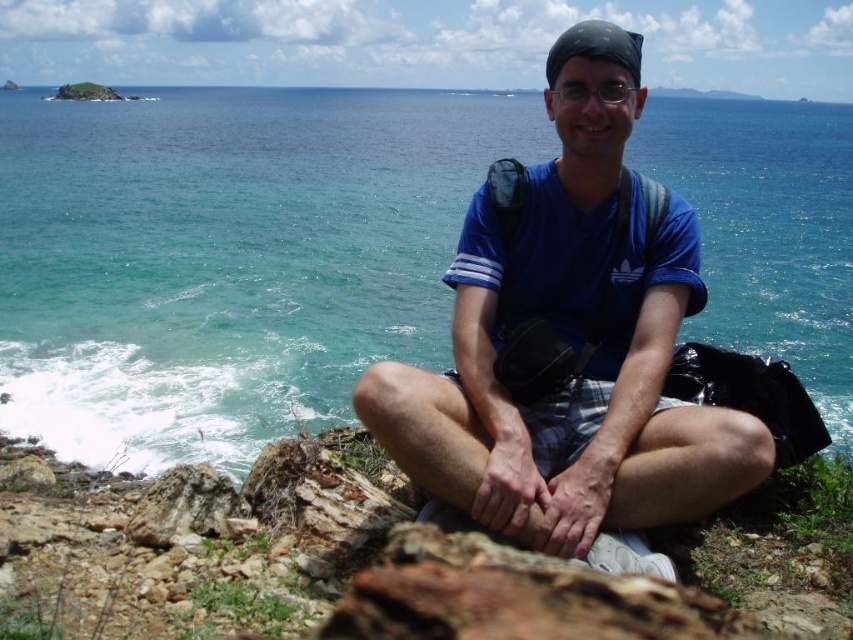
Between point (425, 102) and point (610, 340), which one is positioned behind?

The point (425, 102) is behind.

Which is below, blue water at center or blue cotton shirt at center?

blue cotton shirt at center is lower down.

At what (x,y) coordinates should I click in order to perform the action: click on blue water at center. Please return your answer as a coordinate pair (x, y). Looking at the image, I should click on (228, 257).